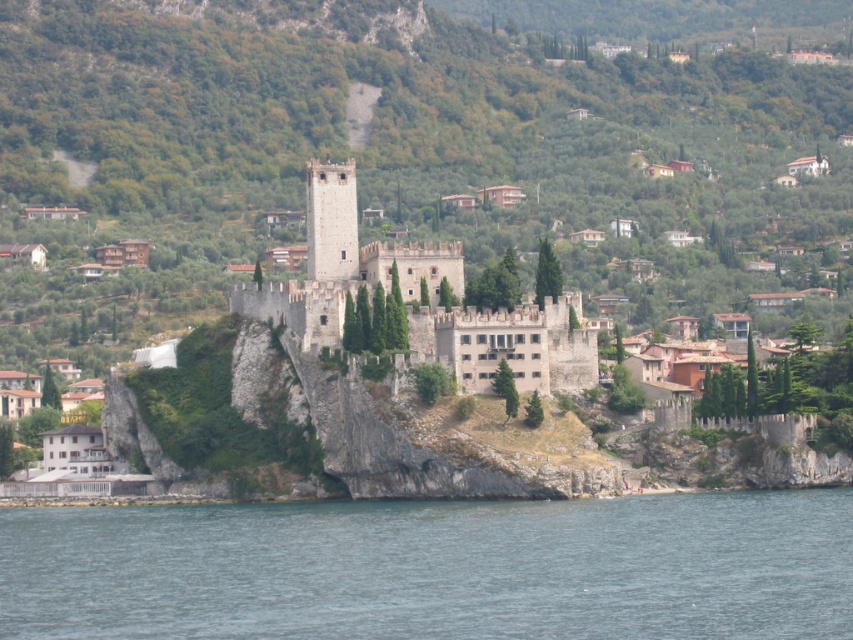
Question: Among these objects, which one is farthest from the camera?

Choices:
 (A) white stone castle at center
 (B) clear blue water at lower center

Answer: (A)

Question: Which object is closer to the camera taking this photo?

Choices:
 (A) white stone castle at center
 (B) clear blue water at lower center

Answer: (B)

Question: From the image, what is the correct spatial relationship of clear blue water at lower center in relation to white stone castle at center?

Choices:
 (A) above
 (B) below

Answer: (B)

Question: Can you confirm if clear blue water at lower center is bigger than white stone castle at center?

Choices:
 (A) yes
 (B) no

Answer: (A)

Question: Is clear blue water at lower center bigger than white stone castle at center?

Choices:
 (A) no
 (B) yes

Answer: (B)

Question: Among these points, which one is farthest from the camera?

Choices:
 (A) click(x=204, y=568)
 (B) click(x=347, y=250)

Answer: (B)